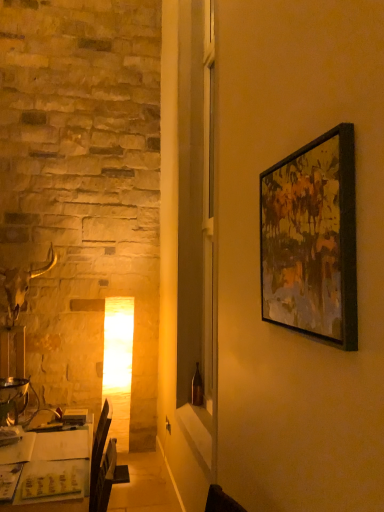
In order to click on black matte picture frame at upper right in this screenshot , I will do 312,240.

What is the approximate width of black matte picture frame at upper right?

It is 2.10 inches.

This screenshot has width=384, height=512. Describe the element at coordinates (312, 240) in the screenshot. I see `black matte picture frame at upper right` at that location.

Image resolution: width=384 pixels, height=512 pixels. What do you see at coordinates (58, 470) in the screenshot? I see `white paper at lower left` at bounding box center [58, 470].

The image size is (384, 512). Identify the location of white paper at lower left. (58, 470).

Where is `black matte picture frame at upper right`? Image resolution: width=384 pixels, height=512 pixels. black matte picture frame at upper right is located at coordinates (312, 240).

Considering the relative positions of white paper at lower left and black matte picture frame at upper right in the image provided, is white paper at lower left to the left or to the right of black matte picture frame at upper right?

In the image, white paper at lower left appears on the left side of black matte picture frame at upper right.

Which is behind, white paper at lower left or black matte picture frame at upper right?

white paper at lower left is further from the camera.

Which is in front, point (33, 455) or point (321, 275)?

Point (321, 275)

From the image's perspective, which one is positioned lower, white paper at lower left or black matte picture frame at upper right?

white paper at lower left.

From a real-world perspective, is white paper at lower left above or below black matte picture frame at upper right?

In terms of real-world spatial position, white paper at lower left is below black matte picture frame at upper right.

Which object is wider, white paper at lower left or black matte picture frame at upper right?

white paper at lower left is wider.

Which of these two, white paper at lower left or black matte picture frame at upper right, stands shorter?

With less height is black matte picture frame at upper right.

Can you confirm if white paper at lower left is bigger than black matte picture frame at upper right?

Indeed, white paper at lower left has a larger size compared to black matte picture frame at upper right.

Is black matte picture frame at upper right inside white paper at lower left?

No.

Is there a large distance between white paper at lower left and black matte picture frame at upper right?

Yes, white paper at lower left is far from black matte picture frame at upper right.

Could you tell me if white paper at lower left is facing black matte picture frame at upper right?

No, white paper at lower left does not turn towards black matte picture frame at upper right.

How many degrees apart are the facing directions of white paper at lower left and black matte picture frame at upper right?

The facing directions of white paper at lower left and black matte picture frame at upper right are 1.55 degrees apart.

Measure the distance from white paper at lower left to black matte picture frame at upper right.

The distance of white paper at lower left from black matte picture frame at upper right is 5.02 feet.

At what (x,y) coordinates should I click in order to perform the action: click on table to the left of black matte picture frame at upper right. Please return your answer as a coordinate pair (x, y). Looking at the image, I should click on (58, 470).

From the picture: Considering the positions of objects black matte picture frame at upper right and white paper at lower left in the image provided, who is more to the left, black matte picture frame at upper right or white paper at lower left?

Positioned to the left is white paper at lower left.

Which object is further away from the camera, black matte picture frame at upper right or white paper at lower left?

white paper at lower left is behind.

Considering the positions of points (331, 198) and (61, 460), is point (331, 198) closer to camera compared to point (61, 460)?

That is True.

From the image's perspective, is black matte picture frame at upper right above or below white paper at lower left?

black matte picture frame at upper right is above white paper at lower left.

In the scene shown: From a real-world perspective, is black matte picture frame at upper right positioned above or below white paper at lower left?

In terms of real-world spatial position, black matte picture frame at upper right is above white paper at lower left.

In terms of width, does black matte picture frame at upper right look wider or thinner when compared to white paper at lower left?

In the image, black matte picture frame at upper right appears to be more narrow than white paper at lower left.

In terms of height, does black matte picture frame at upper right look taller or shorter compared to white paper at lower left?

Clearly, black matte picture frame at upper right is shorter compared to white paper at lower left.

Considering the relative sizes of black matte picture frame at upper right and white paper at lower left in the image provided, is black matte picture frame at upper right smaller than white paper at lower left?

Indeed, black matte picture frame at upper right has a smaller size compared to white paper at lower left.

Is black matte picture frame at upper right surrounding white paper at lower left?

No, white paper at lower left is located outside of black matte picture frame at upper right.

Can you see black matte picture frame at upper right touching white paper at lower left?

No.

Is black matte picture frame at upper right oriented towards white paper at lower left?

No.

How distant is black matte picture frame at upper right from white paper at lower left?

black matte picture frame at upper right is 5.02 feet from white paper at lower left.

Find the location of a particular element. The width and height of the screenshot is (384, 512). table that appears below the black matte picture frame at upper right (from the image's perspective) is located at coordinates (58, 470).

The width and height of the screenshot is (384, 512). Find the location of `table below the black matte picture frame at upper right (from the image's perspective)`. table below the black matte picture frame at upper right (from the image's perspective) is located at coordinates (58, 470).

There is a white paper at lower left. Identify the location of picture frame above it (from a real-world perspective). (312, 240).